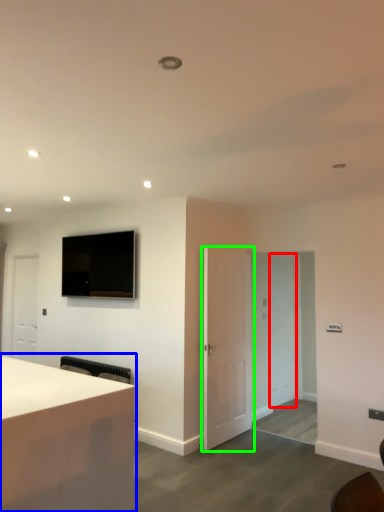
Question: Considering the real-world distances, which object is closest to glass door (highlighted by a red box)? desk (highlighted by a blue box) or door (highlighted by a green box).

Choices:
 (A) desk
 (B) door

Answer: (B)